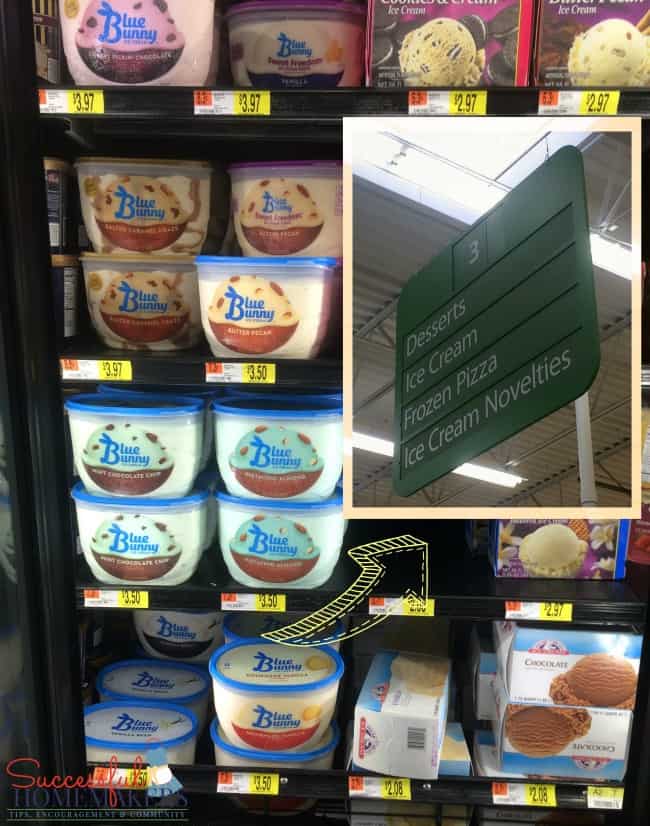
Find the location of a particular element. light bulb is located at coordinates (623, 254), (368, 437).